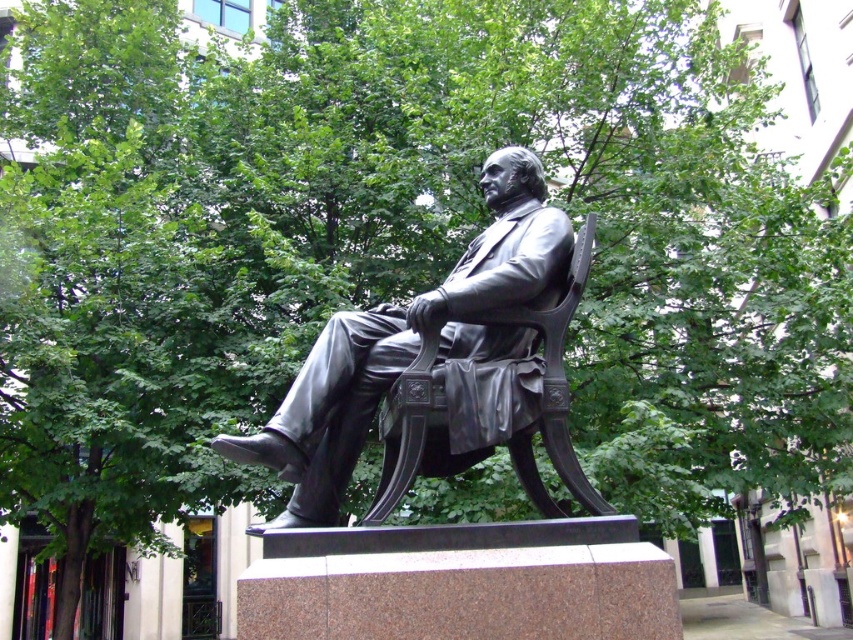
Question: Can you confirm if polished bronze statue at center is wider than black polished wood chair at center?

Choices:
 (A) yes
 (B) no

Answer: (A)

Question: Which point is closer to the camera?

Choices:
 (A) black polished wood chair at center
 (B) polished bronze statue at center

Answer: (B)

Question: Does polished bronze statue at center have a larger size compared to black polished wood chair at center?

Choices:
 (A) no
 (B) yes

Answer: (B)

Question: Is polished bronze statue at center further to camera compared to black polished wood chair at center?

Choices:
 (A) yes
 (B) no

Answer: (B)